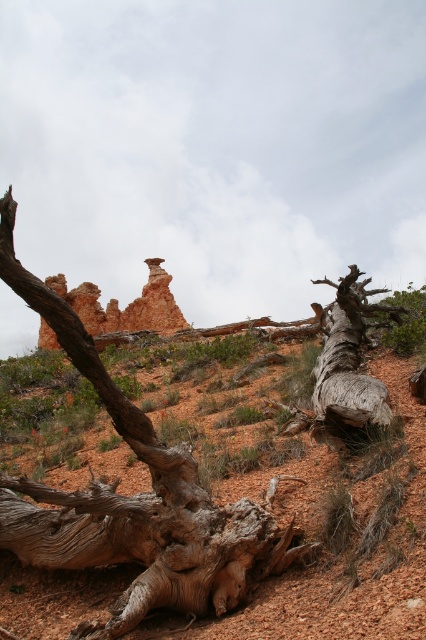
You are a hiker who wants to cross the area between the gray textured log at center and the gray weathered log at lower right. Which log should you step on first to reach the other side?

You should step on the gray textured log at center first because it is positioned to the left of the gray weathered log at lower right, so stepping on the left one first would allow you to cross towards the right side.